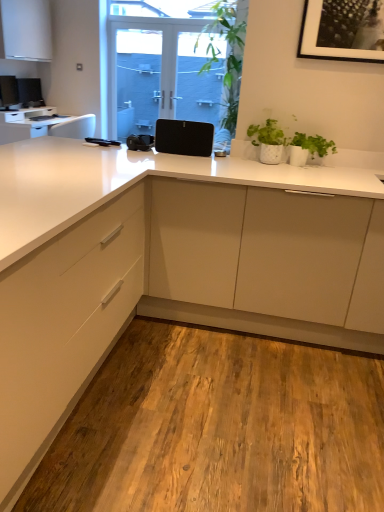
Question: Is black matte speaker at center oriented away from satin black screen door at center, which appears as the first screen door when viewed from the left?

Choices:
 (A) no
 (B) yes

Answer: (B)

Question: Considering the relative sizes of black matte speaker at center and satin black screen door at center, which appears as the first screen door when viewed from the left, in the image provided, is black matte speaker at center smaller than satin black screen door at center, which appears as the first screen door when viewed from the left,?

Choices:
 (A) no
 (B) yes

Answer: (B)

Question: Is black matte speaker at center wider than satin black screen door at center, which ranks as the second screen door in right-to-left order?

Choices:
 (A) yes
 (B) no

Answer: (A)

Question: Is black matte speaker at center closer to the viewer compared to satin black screen door at center, which appears as the first screen door when viewed from the left?

Choices:
 (A) yes
 (B) no

Answer: (A)

Question: Is black matte speaker at center at the right side of satin black screen door at center, which appears as the first screen door when viewed from the left?

Choices:
 (A) yes
 (B) no

Answer: (A)

Question: Would you say black matte speaker at center is a long distance from satin black screen door at center, which ranks as the second screen door in right-to-left order?

Choices:
 (A) yes
 (B) no

Answer: (A)

Question: Does black matte speaker at center have a greater height compared to green matte plant at upper right, the first houseplant in the right-to-left sequence?

Choices:
 (A) yes
 (B) no

Answer: (A)

Question: Is the depth of black matte speaker at center less than that of green matte plant at upper right, the first houseplant in the right-to-left sequence?

Choices:
 (A) no
 (B) yes

Answer: (A)

Question: Can you confirm if black matte speaker at center is bigger than green matte plant at upper right, the first houseplant in the right-to-left sequence?

Choices:
 (A) no
 (B) yes

Answer: (B)

Question: Would you say black matte speaker at center contains green matte plant at upper right, the first houseplant in the right-to-left sequence?

Choices:
 (A) yes
 (B) no

Answer: (B)

Question: Can you confirm if black matte speaker at center is shorter than green matte plant at upper right, the first houseplant in the right-to-left sequence?

Choices:
 (A) no
 (B) yes

Answer: (A)

Question: Can you see black matte speaker at center touching green matte plant at upper right, the first houseplant in the right-to-left sequence?

Choices:
 (A) no
 (B) yes

Answer: (A)

Question: Does white glossy countertop at upper left, marked as the first countertop in a top-to-bottom arrangement, have a larger size compared to transparent glass screen door at upper center, placed as the 1th screen door when sorted from right to left?

Choices:
 (A) yes
 (B) no

Answer: (A)